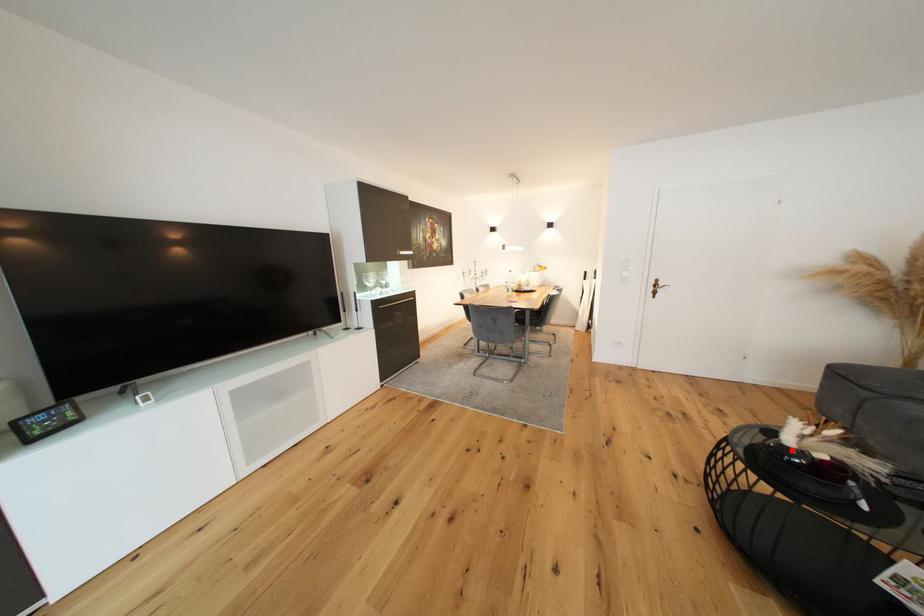
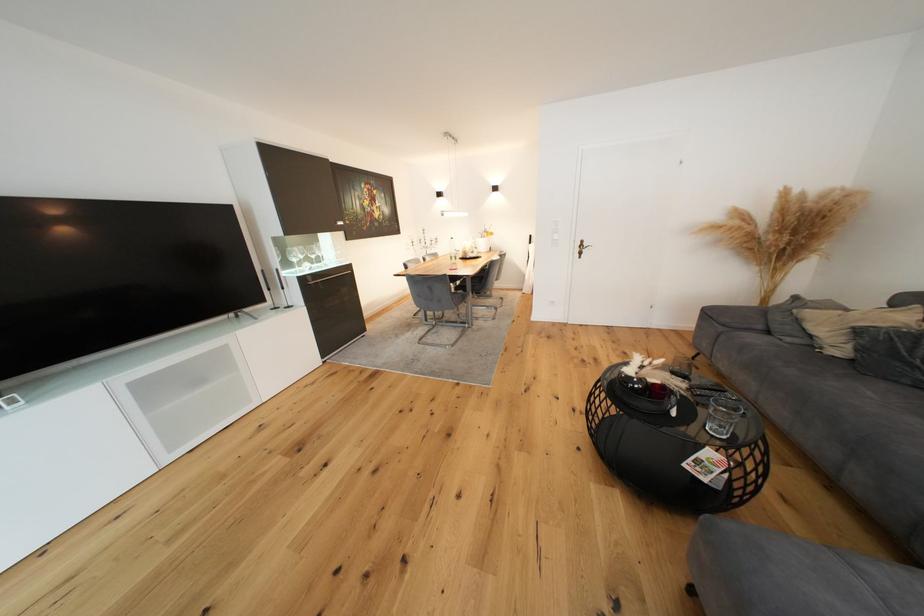
Locate, in the second image, the point that corresponds to the highlighted location in the first image.

(637, 379)